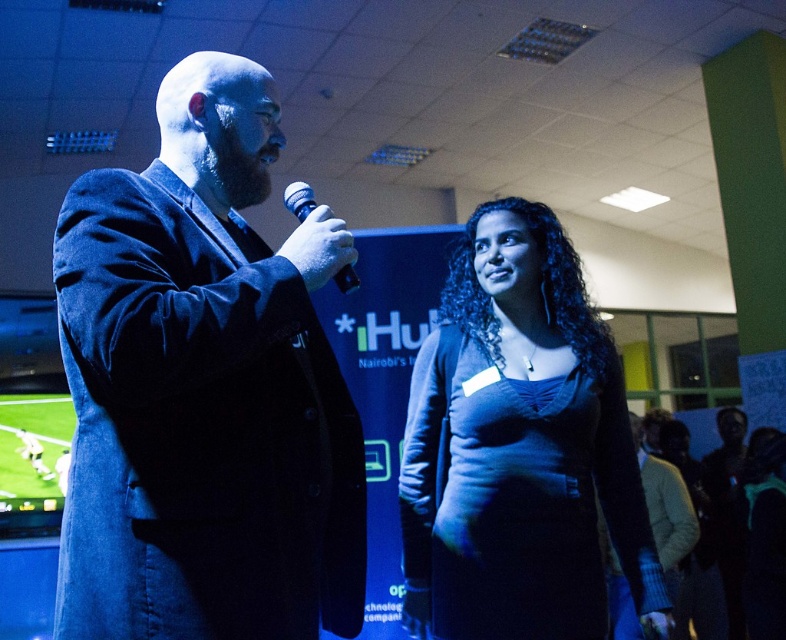
Which is below, dark blue suit at left or white matte microphone at center?

dark blue suit at left is lower down.

Locate an element on the screen. The width and height of the screenshot is (786, 640). dark blue suit at left is located at coordinates (204, 388).

Locate an element on the screen. The image size is (786, 640). dark blue suit at left is located at coordinates (204, 388).

Does dark blue suit at left have a larger size compared to blue matte dress at center?

No, dark blue suit at left is not bigger than blue matte dress at center.

Between point (182, 337) and point (502, 448), which one is positioned in front?

Point (182, 337)

Does point (134, 440) come behind point (601, 340)?

That is False.

Where is `dark blue suit at left`? Image resolution: width=786 pixels, height=640 pixels. dark blue suit at left is located at coordinates point(204,388).

Consider the image. Can you confirm if blue matte dress at center is positioned to the right of white matte microphone at center?

Yes, blue matte dress at center is to the right of white matte microphone at center.

This screenshot has height=640, width=786. Find the location of `blue matte dress at center`. blue matte dress at center is located at coordinates (520, 449).

Image resolution: width=786 pixels, height=640 pixels. Find the location of `blue matte dress at center`. blue matte dress at center is located at coordinates (520, 449).